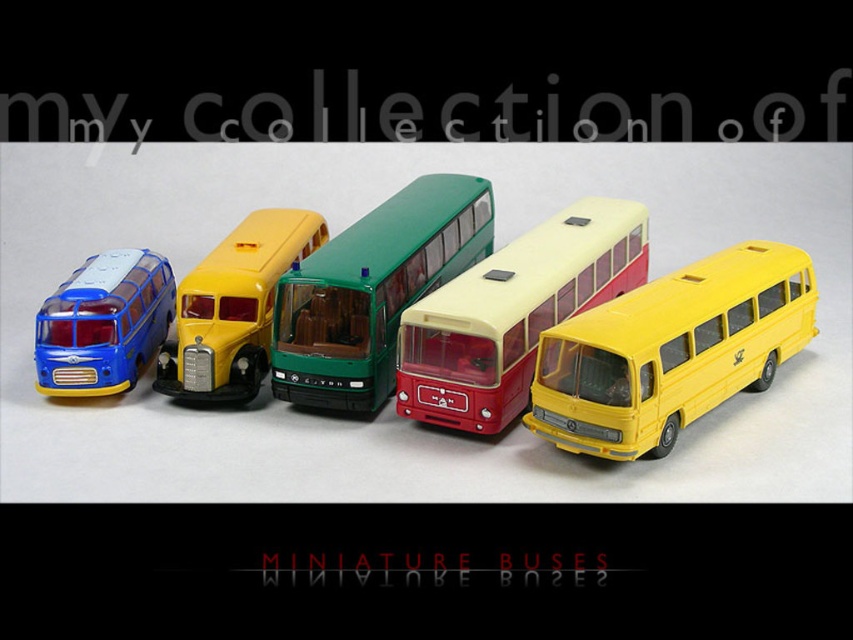
Can you confirm if blue matte bus at left is positioned below matte green double-decker bus at center?

Yes, blue matte bus at left is below matte green double-decker bus at center.

Does blue matte bus at left appear on the right side of matte green double-decker bus at center?

No, blue matte bus at left is not to the right of matte green double-decker bus at center.

Identify the location of blue matte bus at left. (599, 333).

I want to click on blue matte bus at left, so click(x=599, y=333).

Is blue matte bus at left thinner than matte yellow bus at center?

In fact, blue matte bus at left might be wider than matte yellow bus at center.

Which is below, blue matte bus at left or matte yellow bus at center?

Positioned lower is matte yellow bus at center.

Describe the element at coordinates (599, 333) in the screenshot. I see `blue matte bus at left` at that location.

The height and width of the screenshot is (640, 853). What are the coordinates of `blue matte bus at left` in the screenshot? It's located at (599, 333).

This screenshot has height=640, width=853. I want to click on blue matte bus at left, so click(599, 333).

Does blue matte bus at left have a greater width compared to green matte/deep plastic bus at center?

Yes.

This screenshot has width=853, height=640. What are the coordinates of `blue matte bus at left` in the screenshot? It's located at (599, 333).